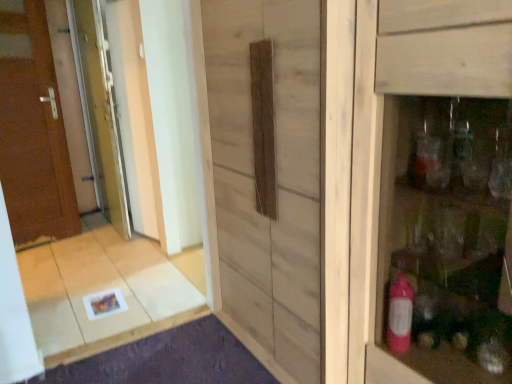
Question: Does brown wooden door at left have a larger size compared to natural wood barn door at center?

Choices:
 (A) yes
 (B) no

Answer: (B)

Question: Is brown wooden door at left further to camera compared to natural wood barn door at center?

Choices:
 (A) yes
 (B) no

Answer: (A)

Question: From a real-world perspective, is brown wooden door at left located higher than natural wood barn door at center?

Choices:
 (A) no
 (B) yes

Answer: (B)

Question: Considering the relative sizes of brown wooden door at left and natural wood barn door at center in the image provided, is brown wooden door at left smaller than natural wood barn door at center?

Choices:
 (A) yes
 (B) no

Answer: (A)

Question: Is brown wooden door at left aimed at natural wood barn door at center?

Choices:
 (A) no
 (B) yes

Answer: (B)

Question: Can you confirm if brown wooden door at left is shorter than natural wood barn door at center?

Choices:
 (A) no
 (B) yes

Answer: (A)

Question: Considering the relative sizes of clear glass screen door at left, which is the first screen door from right to left, and natural wood barn door at center in the image provided, is clear glass screen door at left, which is the first screen door from right to left, smaller than natural wood barn door at center?

Choices:
 (A) no
 (B) yes

Answer: (B)

Question: From the image's perspective, is clear glass screen door at left, acting as the 2th screen door starting from the left, under natural wood barn door at center?

Choices:
 (A) no
 (B) yes

Answer: (A)

Question: Is natural wood barn door at center inside clear glass screen door at left, which is the first screen door from right to left?

Choices:
 (A) no
 (B) yes

Answer: (A)

Question: Does clear glass screen door at left, acting as the 2th screen door starting from the left, appear on the right side of natural wood barn door at center?

Choices:
 (A) yes
 (B) no

Answer: (B)

Question: Is clear glass screen door at left, acting as the 2th screen door starting from the left, aimed at natural wood barn door at center?

Choices:
 (A) no
 (B) yes

Answer: (A)

Question: Is clear glass screen door at left, acting as the 2th screen door starting from the left, far away from natural wood barn door at center?

Choices:
 (A) no
 (B) yes

Answer: (B)

Question: From the image's perspective, is clear glass screen door at left, the second screen door viewed from the right, under matte wooden cabinet at right?

Choices:
 (A) no
 (B) yes

Answer: (A)